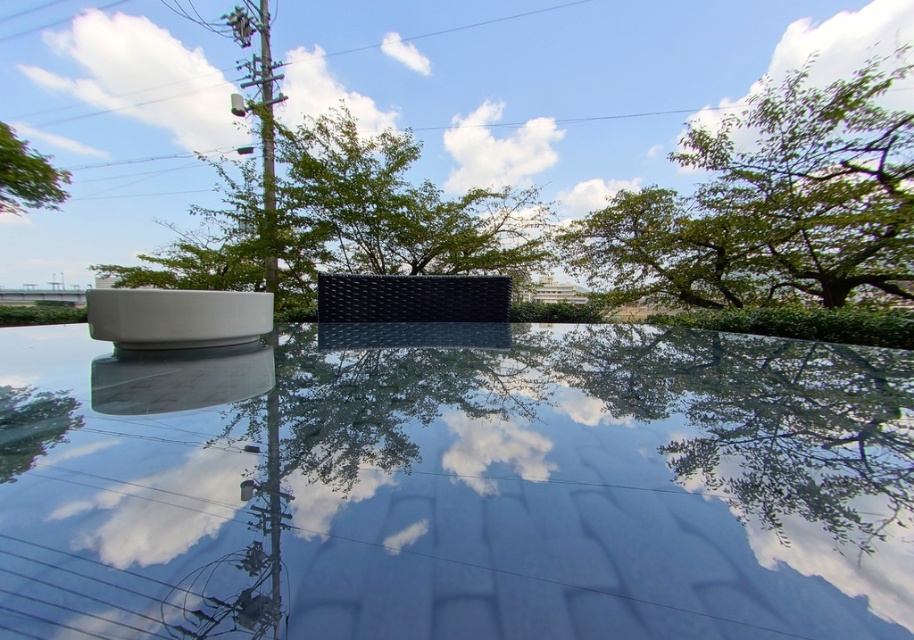
You are standing in the middle of the reflective surface and see a green leafy tree reflected at point (771, 204). If you walk towards the tree, will you move towards the upper right direction?

Yes, because the green leafy tree at upper right is located at point (771, 204), which is in the upper right direction from your current position in the middle of the reflective surface.